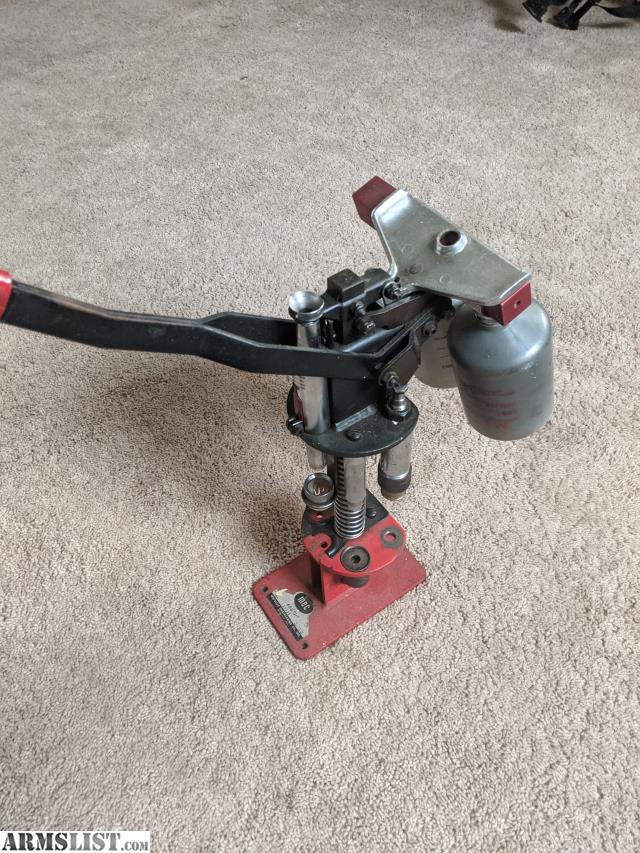
At what (x,y) coordinates should I click in order to perform the action: click on handle. Please return your answer as a coordinate pair (x, y). The height and width of the screenshot is (853, 640). Looking at the image, I should click on (4, 289).